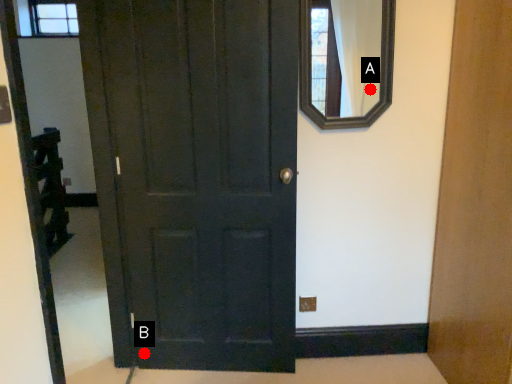
Question: Two points are circled on the image, labeled by A and B beside each circle. Which point is farther from the camera taking this photo?

Choices:
 (A) A is further
 (B) B is further

Answer: (B)